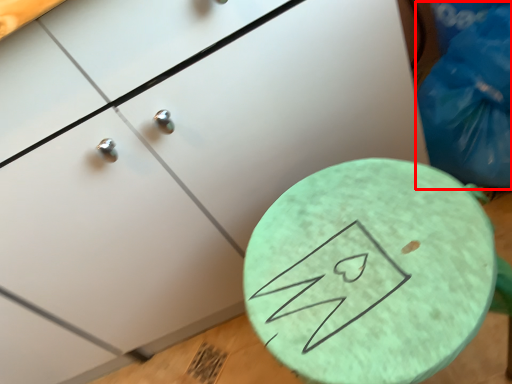
Question: From the image's perspective, what is the correct spatial positioning of garbage (annotated by the red box) in reference to round table?

Choices:
 (A) above
 (B) below

Answer: (A)